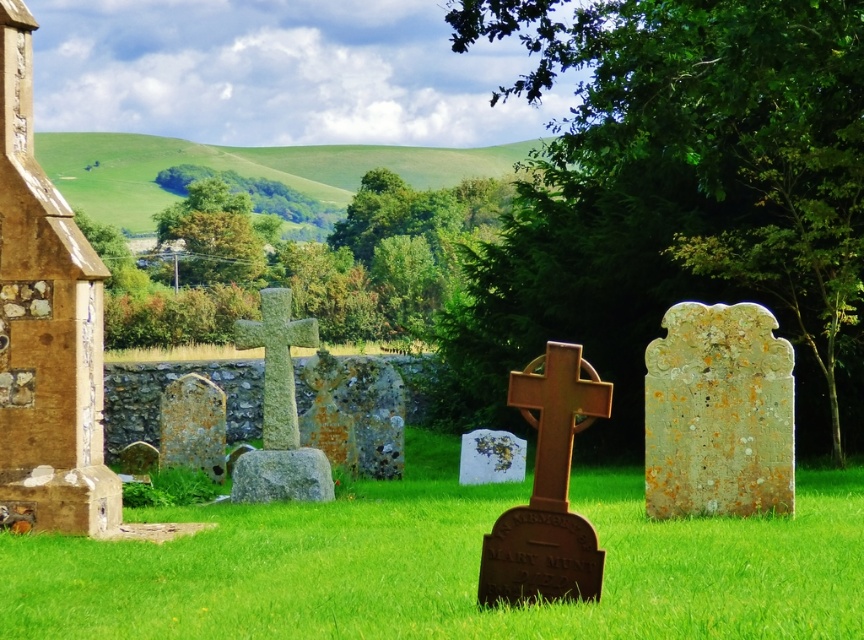
You are a visitor at the cemetery and want to take a photo that includes both the green stone cross at center and the gray stone gravestone at center. Which object will appear larger in the photo?

The green stone cross at center will appear larger in the photo because it is taller than the gray stone gravestone at center.